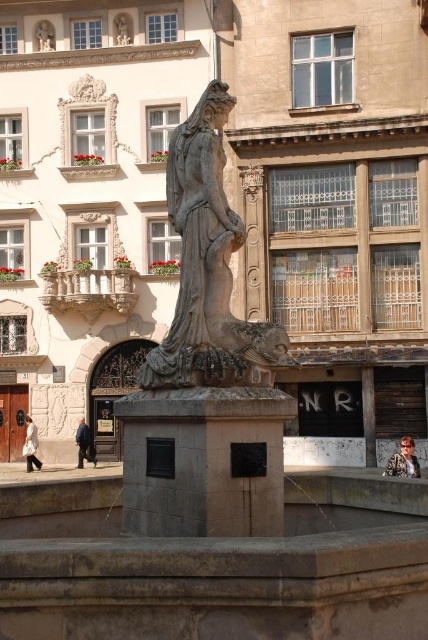
You are standing in the historical urban scene described. You see the bronze statue at center and the dark blue jeans at lower left. Which object is positioned to the right of the other?

The bronze statue at center is to the right of dark blue jeans at lower left.

From the picture: You are an architect designing a new pathway that needs to pass between the shiny brown hair at center and the white fabric coat at lower left. The pathway must be at least 20 meters wide to accommodate large vehicles. Can the pathway be constructed between these two objects?

The shiny brown hair at center and the white fabric coat at lower left are 21.06 meters apart from each other. Since the required width is 20 meters, the pathway can be constructed between them as the distance is sufficient.